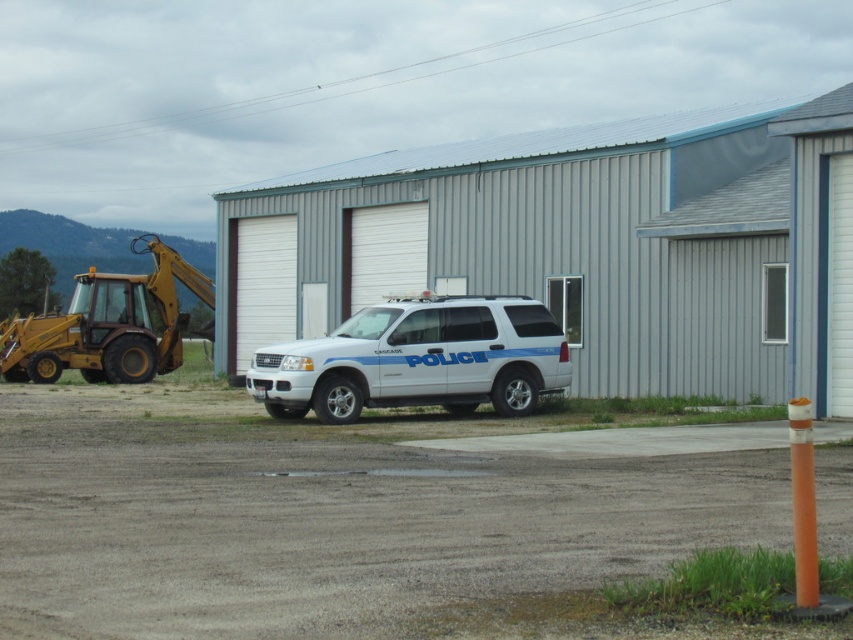
Is white matte police car at center shorter than yellow metallic excavator at left?

Yes, white matte police car at center is shorter than yellow metallic excavator at left.

Is white matte police car at center bigger than yellow metallic excavator at left?

Incorrect, white matte police car at center is not larger than yellow metallic excavator at left.

Who is more distant from viewer, (403,326) or (78,339)?

The point (78,339) is more distant.

Identify the location of white matte police car at center. Image resolution: width=853 pixels, height=640 pixels. (x=416, y=358).